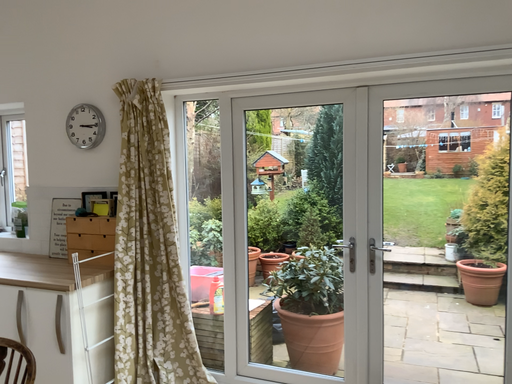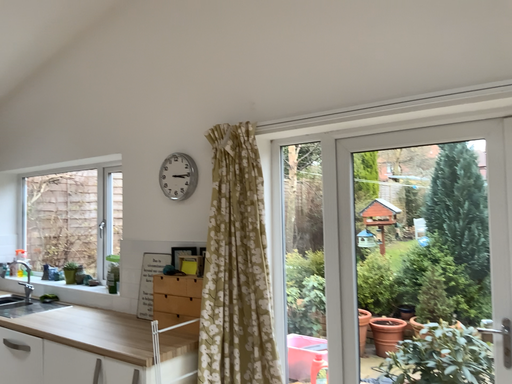
Question: How did the camera likely rotate when shooting the video?

Choices:
 (A) rotated downward
 (B) rotated upward

Answer: (B)